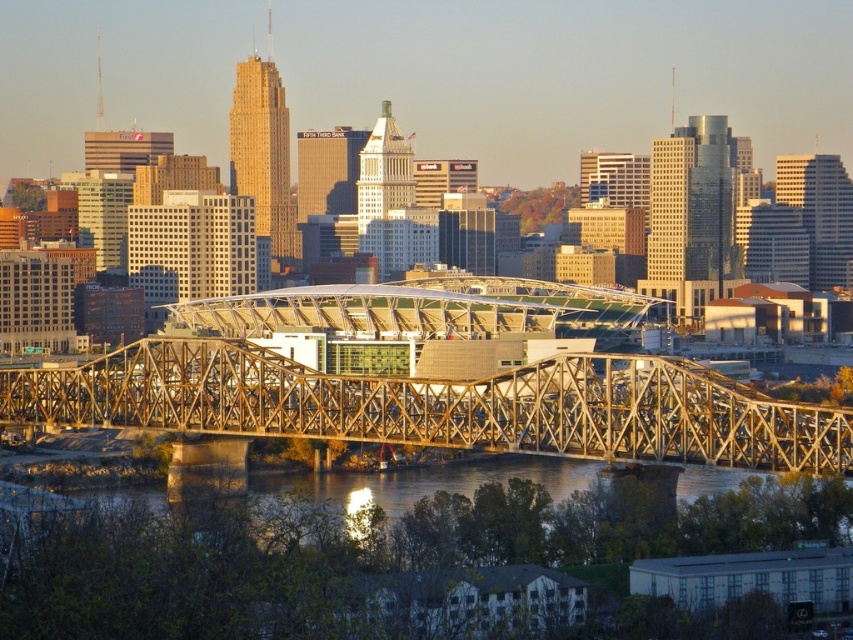
Question: Which of the following is the closest to the observer?

Choices:
 (A) greenish water at lower center
 (B) golden metallic bridge at center

Answer: (B)

Question: Which of the following is the farthest from the observer?

Choices:
 (A) (314, 484)
 (B) (287, 388)

Answer: (A)

Question: Can you confirm if golden metallic bridge at center is wider than greenish water at lower center?

Choices:
 (A) yes
 (B) no

Answer: (B)

Question: Does golden metallic bridge at center appear under greenish water at lower center?

Choices:
 (A) no
 (B) yes

Answer: (A)

Question: Considering the relative positions of golden metallic bridge at center and greenish water at lower center in the image provided, where is golden metallic bridge at center located with respect to greenish water at lower center?

Choices:
 (A) left
 (B) right

Answer: (B)